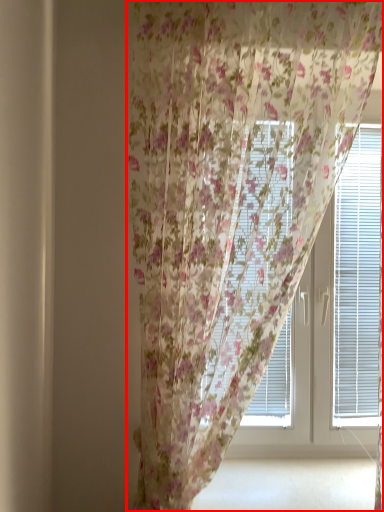
Question: From the image's perspective, what is the correct spatial positioning of curtain (annotated by the red box) in reference to bay window?

Choices:
 (A) above
 (B) below

Answer: (A)